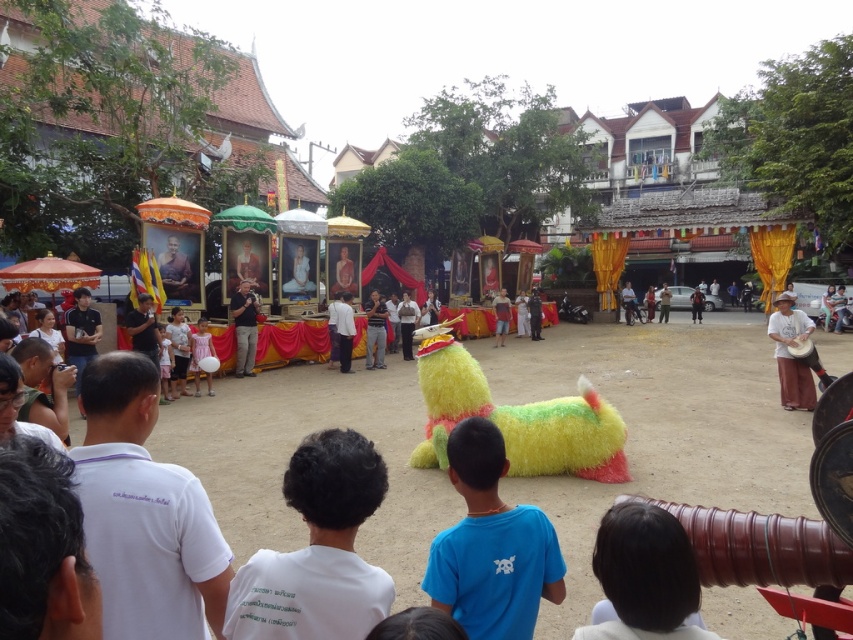
Question: Is fuzzy yellow toy at center behind pink satin dress at center?

Choices:
 (A) no
 (B) yes

Answer: (A)

Question: Considering the real-world distances, which object is farthest from the black matte shirt at center?

Choices:
 (A) pink satin dress at center
 (B) white cotton hat at right
 (C) light pink fabric dress at lower center

Answer: (B)

Question: Is fuzzy yellow toy at center below white cotton hat at right?

Choices:
 (A) yes
 (B) no

Answer: (A)

Question: Considering the real-world distances, which object is closest to the light pink fabric dress at lower center?

Choices:
 (A) fuzzy yellow toy at center
 (B) blue fuzzy shirt at center
 (C) pink satin dress at center
 (D) white matte shirt at lower left

Answer: (C)

Question: Does white matte shirt at lower left appear under light pink fabric dress at lower center?

Choices:
 (A) yes
 (B) no

Answer: (A)

Question: Which of these objects is positioned closest to the white matte shirt at lower left?

Choices:
 (A) blue fuzzy shirt at center
 (B) light pink fabric dress at lower center

Answer: (A)